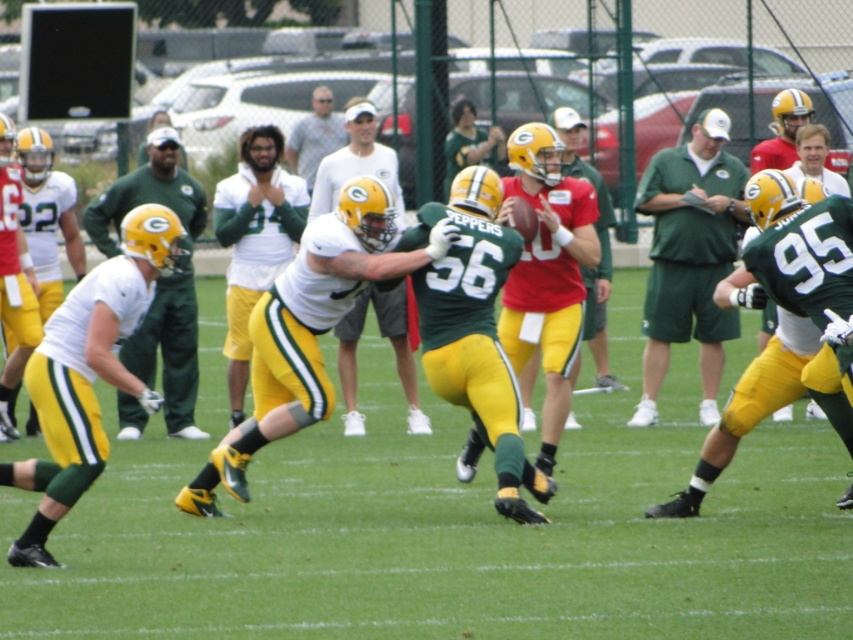
Does green matte jersey at center have a greater width compared to matte green shorts at center?

Indeed, green matte jersey at center has a greater width compared to matte green shorts at center.

Which is more to the right, green matte jersey at center or matte green shorts at center?

green matte jersey at center

Which is in front, point (740, 387) or point (706, 188)?

Point (740, 387) is in front.

Find the location of a particular element. Image resolution: width=853 pixels, height=640 pixels. green matte jersey at center is located at coordinates click(x=778, y=314).

Can you confirm if white matte jersey at left is positioned below matte green shorts at center?

Correct, white matte jersey at left is located below matte green shorts at center.

Who is positioned more to the right, white matte jersey at left or matte green shorts at center?

matte green shorts at center is more to the right.

Where is `white matte jersey at left`? This screenshot has width=853, height=640. white matte jersey at left is located at coordinates (90, 371).

Where is `white matte jersey at left`? Image resolution: width=853 pixels, height=640 pixels. white matte jersey at left is located at coordinates (90, 371).

Can you confirm if white matte helmet at center is positioned below white cotton shirt at center?

Yes, white matte helmet at center is below white cotton shirt at center.

Does white matte helmet at center appear on the left side of white cotton shirt at center?

Correct, you'll find white matte helmet at center to the left of white cotton shirt at center.

Measure the distance between white matte helmet at center and camera.

white matte helmet at center and camera are 39.76 feet apart from each other.

The height and width of the screenshot is (640, 853). I want to click on white matte helmet at center, so click(x=169, y=352).